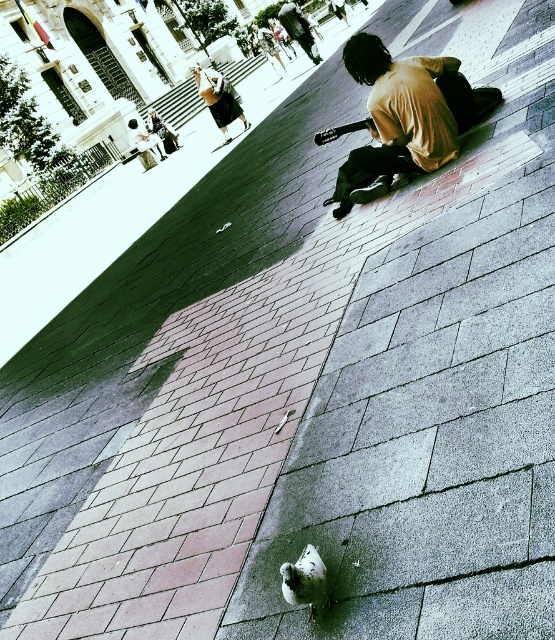
You are a photographer standing at the scene. You want to take a photo of the light brown cotton shirt at lower right and the brown leather jacket at upper center. The camera can focus on objects within 10 meters. Will both objects be in focus?

The light brown cotton shirt at lower right is 13.45 meters from the brown leather jacket at upper center. Since the camera can only focus within 10 meters, the distance between them exceeds the focus range, so both objects cannot be in focus simultaneously.

You are standing at the point marked as point (392, 90) in the image, which is 4.51 meters away from you. You want to walk towards the guitar player sitting on the pavement. Which direction should you face to walk directly towards them?

You should face towards the guitar player, as the point (392, 90) is 4.51 meters away from you. However, the exact direction isn t specified in the provided information, so you might need to look at the image to determine left, right, forward, etc.

Consider the image. You are a photographer positioned at the center of the scene. You want to capture a photo that includes both the light brown cotton shirt at lower right and the white matte pigeon at lower center. Which object should you pan your camera towards first to ensure both are in frame?

You should pan your camera towards the white matte pigeon at lower center first because the light brown cotton shirt at lower right is to the right of it, so starting from the pigeon and moving right will include both in the frame.